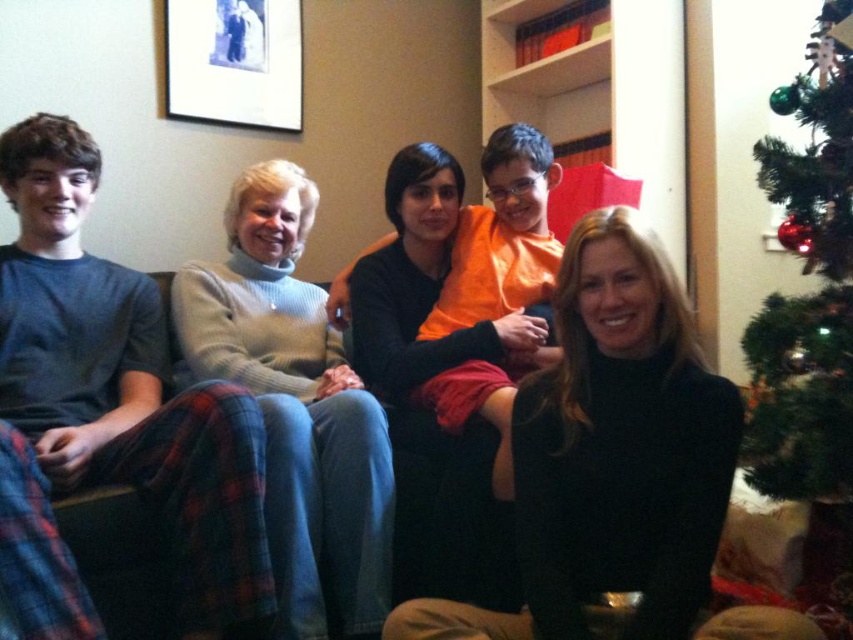
Between matte black sweater at center and black turtleneck sweater at center, which one has more height?

Standing taller between the two is matte black sweater at center.

Looking at this image, who is shorter, matte black sweater at center or black turtleneck sweater at center?

Standing shorter between the two is black turtleneck sweater at center.

You are a GUI agent. You are given a task and a screenshot of the screen. Output one action in this format:
    pyautogui.click(x=<x>, y=<y>)
    Task: Click on the matte black sweater at center
    The height and width of the screenshot is (640, 853).
    Given the screenshot: What is the action you would take?
    pyautogui.click(x=120, y=420)

Identify the location of matte black sweater at center. 120,420.

Can you confirm if matte black sweater at center is thinner than black matte picture frame at upper left?

No, matte black sweater at center is not thinner than black matte picture frame at upper left.

Does matte black sweater at center have a lesser height compared to black matte picture frame at upper left?

In fact, matte black sweater at center may be taller than black matte picture frame at upper left.

Which is in front, point (24, 291) or point (270, 60)?

Positioned in front is point (24, 291).

What are the coordinates of `matte black sweater at center` in the screenshot? It's located at (120, 420).

Is point (368, 452) farther from camera compared to point (769, 488)?

No.

Who is positioned more to the left, light gray turtleneck sweater at center or green artificial tree at right?

Positioned to the left is light gray turtleneck sweater at center.

Is point (267, 285) farther from camera compared to point (845, 177)?

Yes, point (267, 285) is behind point (845, 177).

This screenshot has height=640, width=853. In order to click on light gray turtleneck sweater at center in this screenshot , I will do `click(296, 406)`.